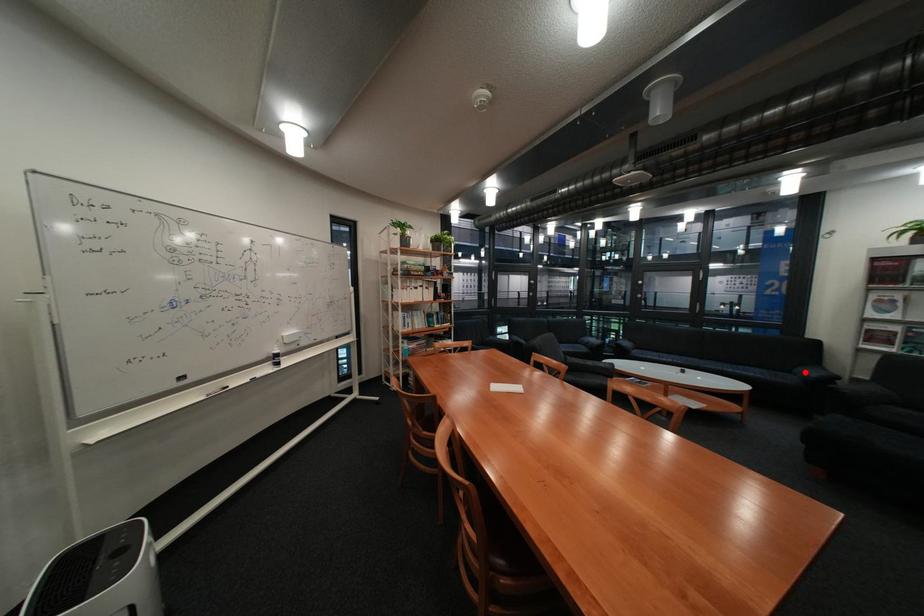
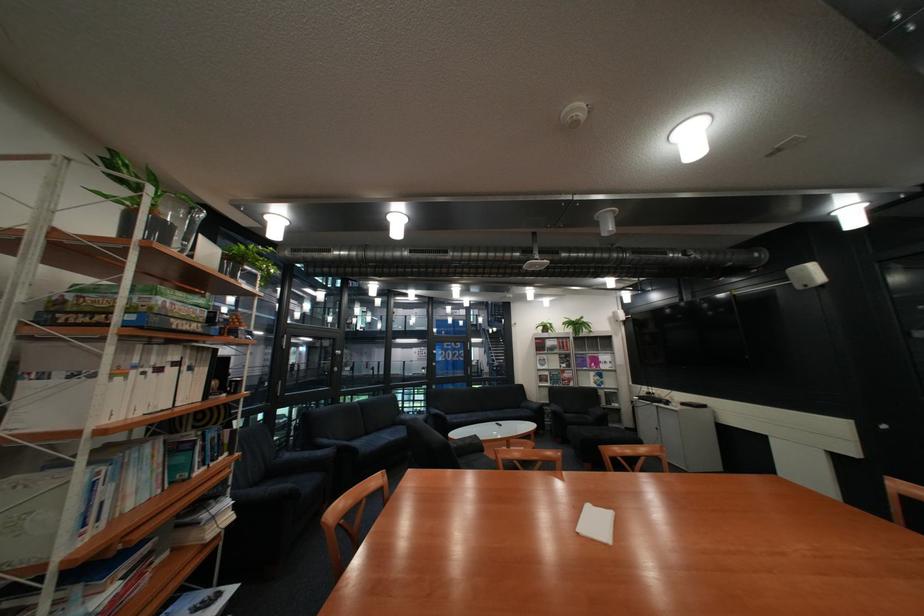
Question: I am providing you with two images of the same scene from different viewpoints. In image1, a red point is highlighted. Considering the same 3D point in image2, which of the following is correct?

Choices:
 (A) It is closer
 (B) It is farther

Answer: (B)